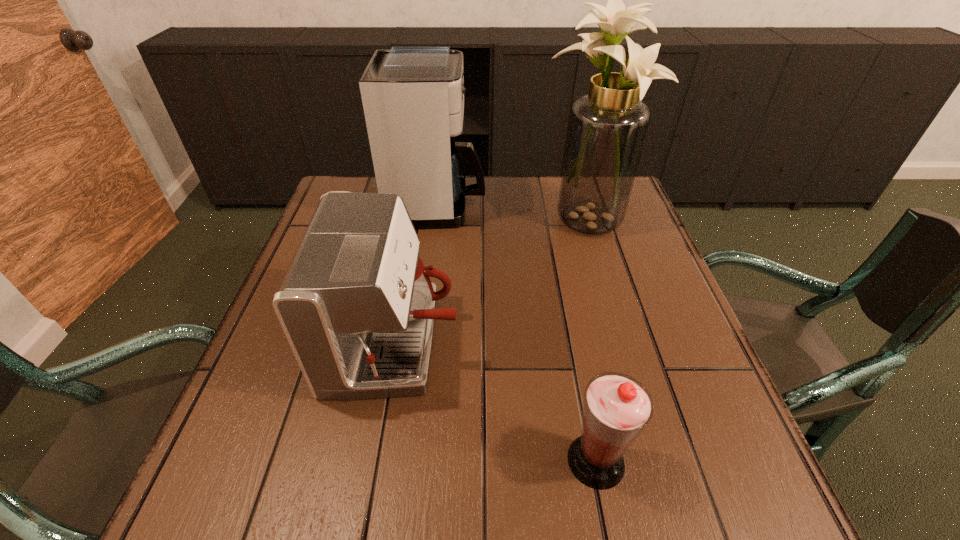
Where is `vacant space that satisfies the following two spatial constraints: 1. on the front panel of the second tallest object; 2. on the back side of the flower arrangement`? The width and height of the screenshot is (960, 540). vacant space that satisfies the following two spatial constraints: 1. on the front panel of the second tallest object; 2. on the back side of the flower arrangement is located at coordinates (436, 221).

I want to click on free space that satisfies the following two spatial constraints: 1. on the front of the smoothie near the spout; 2. on the left side of the third farthest object, so click(x=374, y=461).